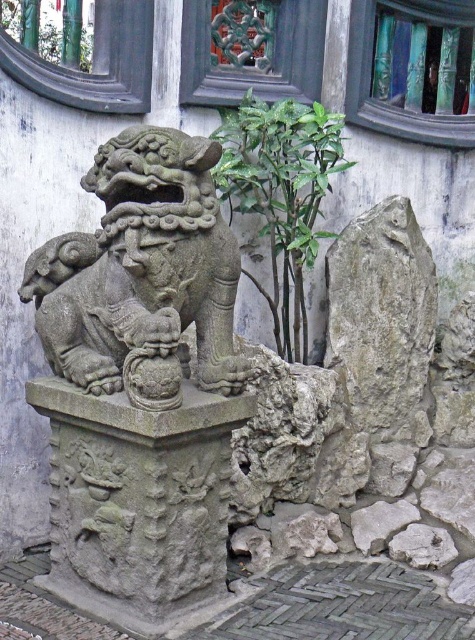
Is gray rough rock at center positioned before green leafy plant at center?

No, gray rough rock at center is further to the viewer.

From the picture: Measure the distance between point (361, 273) and camera.

The distance of point (361, 273) from camera is 3.00 meters.

Where is `gray rough rock at center`? Image resolution: width=475 pixels, height=640 pixels. gray rough rock at center is located at coordinates (x=382, y=317).

Where is `gray rough rock at center`? This screenshot has height=640, width=475. gray rough rock at center is located at coordinates (382, 317).

Between gray stone lion at center and gray stone pedestal at center, which one appears on the right side from the viewer's perspective?

gray stone lion at center is more to the right.

Can you confirm if gray stone lion at center is positioned below gray stone pedestal at center?

Actually, gray stone lion at center is above gray stone pedestal at center.

Which is in front, point (91, 333) or point (142, 508)?

Point (142, 508)

This screenshot has height=640, width=475. Find the location of `gray stone lion at center`. gray stone lion at center is located at coordinates pos(142,275).

Is gray stone pedestal at center to the right of green leafy plant at center from the viewer's perspective?

In fact, gray stone pedestal at center is to the left of green leafy plant at center.

Who is more distant from viewer, (212, 528) or (228, 125)?

Point (228, 125)

I want to click on gray stone pedestal at center, so click(138, 502).